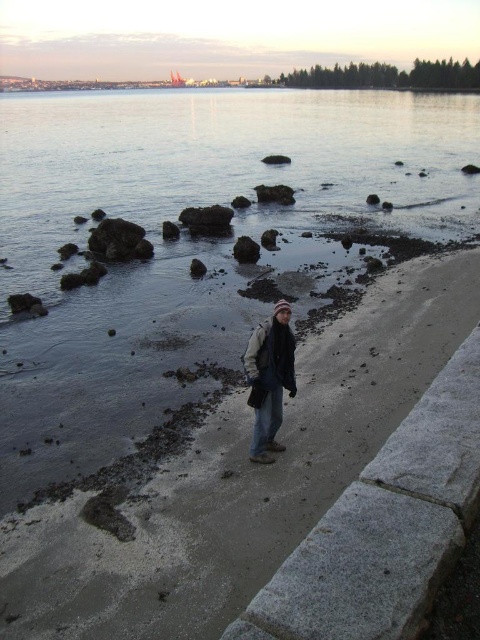
You are a photographer trying to capture the reflection of the sky in the water. You have the clear water at center and the dark gray knit hat at center in your viewfinder. Which object will allow you to see the reflection of the sky better?

The clear water at center allows better reflection of the sky since it is larger in size than the dark gray knit hat at center.

You are standing on the beach looking towards the water. There are two points marked on the image, one at coordinates point [171,504] and another at point [476,356]. Which point is closer to you?

Point [476,356] is closer to you because it is in front of point [171,504].

You are standing on the beach and want to place the dark gray knit hat at center on the sand. However, you notice the clear water at center is in the way. Can the hat be placed on the sand without moving the water?

The clear water at center has a larger width than the dark gray knit hat at center. Since the water is in the way, you would need to move the water to place the hat on the sand, but water cannot be moved easily. Therefore, it is not advisable to place the hat there without disturbing the water.